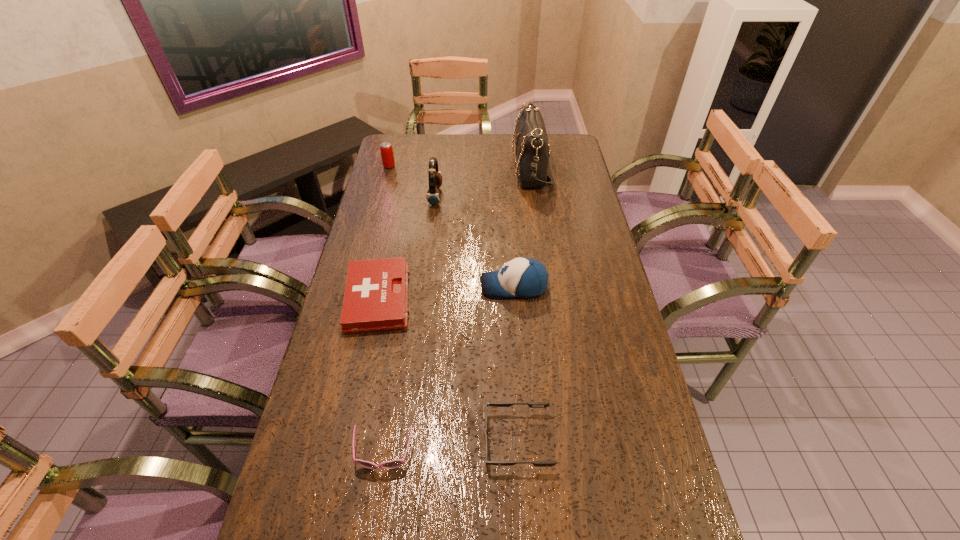
Identify which object is located as the sixth nearest to the right sunglasses. Please provide its 2D coordinates. Your answer should be formatted as a tuple, i.e. [(x, y)], where the tuple contains the x and y coordinates of a point satisfying the conditions above.

[(386, 149)]

This screenshot has height=540, width=960. What are the coordinates of `object that stands as the second closest to the sixth shortest object` in the screenshot? It's located at (532, 151).

This screenshot has width=960, height=540. I want to click on blank space that satisfies the following two spatial constraints: 1. on the temples of the right sunglasses; 2. on the front-facing side of the left sunglasses, so click(517, 453).